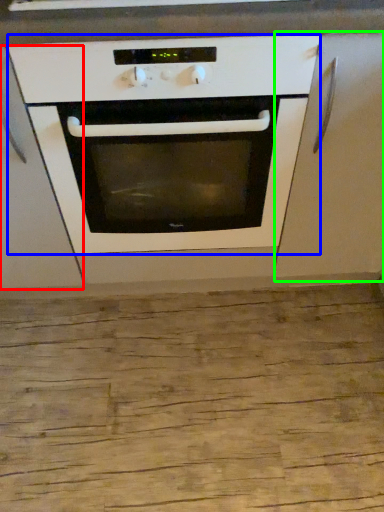
Question: Considering the real-world distances, which object is farthest from cabinetry (highlighted by a red box)? oven (highlighted by a blue box) or cabinetry (highlighted by a green box)?

Choices:
 (A) oven
 (B) cabinetry

Answer: (B)